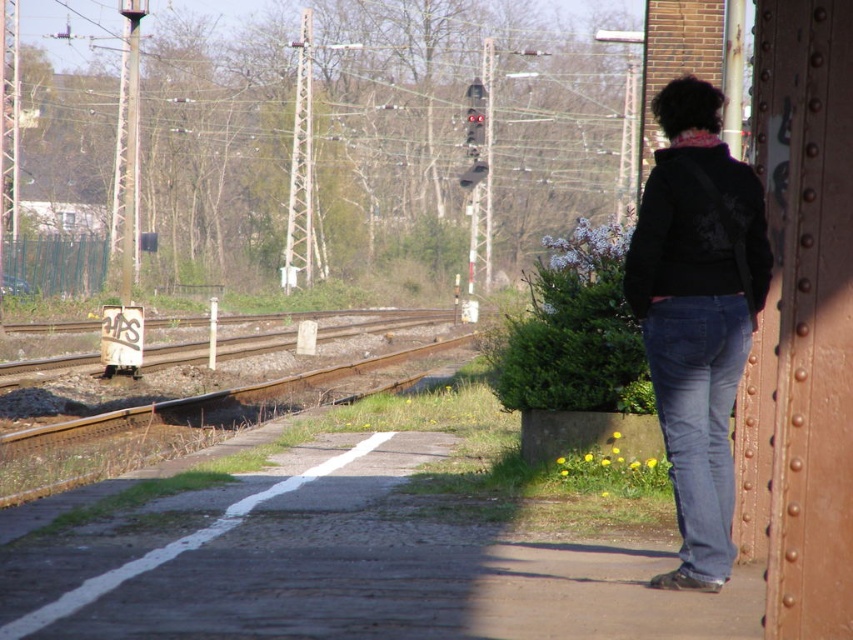
You are a photographer trying to capture the rusty metal train track at center and the dark blue jeans at right in a single frame. Based on their widths, which object should you focus on first to ensure both fit in the photo?

The dark blue jeans at right has a lesser width compared to the rusty metal train track at center, so you should focus on the rusty metal train track at center first to ensure both fit in the photo.

You are standing on the platform and see the point marked at coordinates (697, 314). What object is located at that point?

The point at coordinates (697, 314) corresponds to dark blue jeans at right.